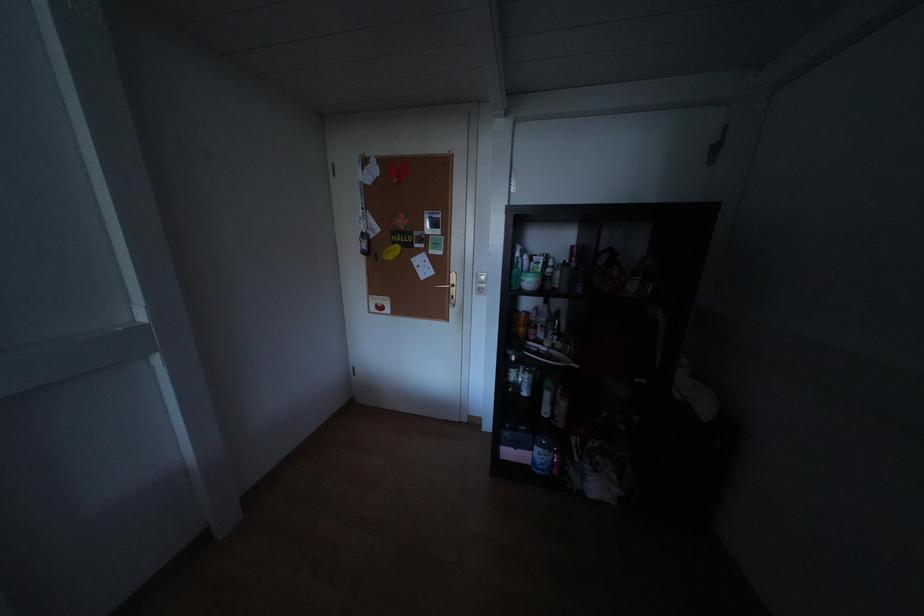
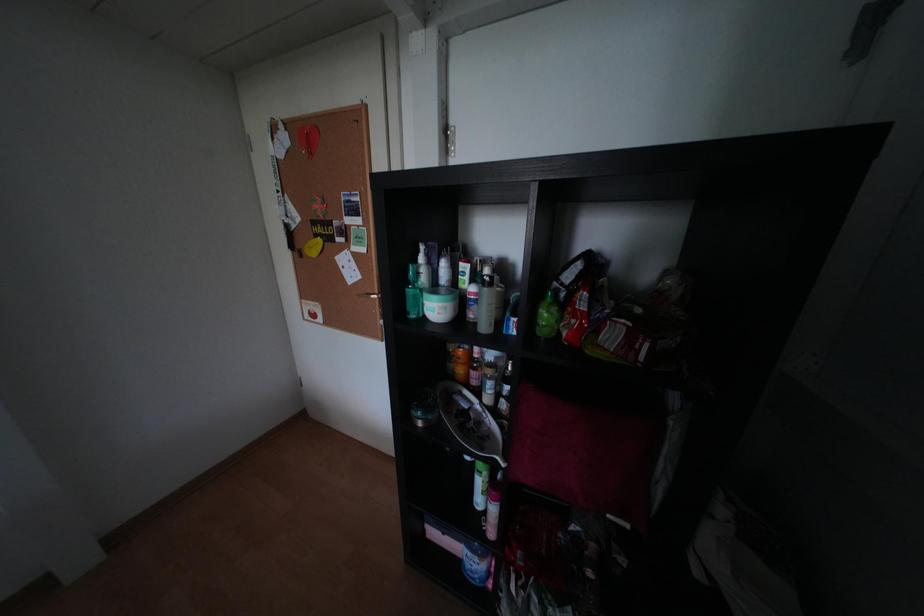
Question: How did the camera likely rotate?

Choices:
 (A) Left
 (B) Right
 (C) Up
 (D) Down

Answer: (A)